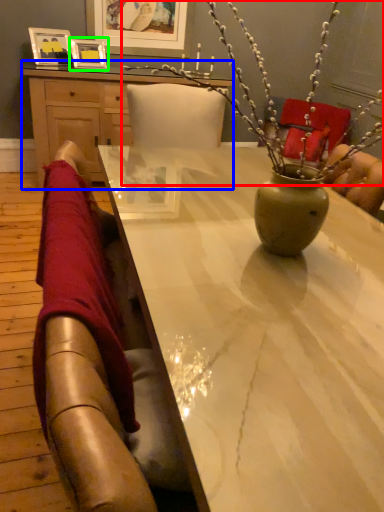
Question: Which object is positioned closest to floral arrangement (highlighted by a red box)? Select from desk (highlighted by a blue box) and picture frame (highlighted by a green box).

Choices:
 (A) desk
 (B) picture frame

Answer: (A)